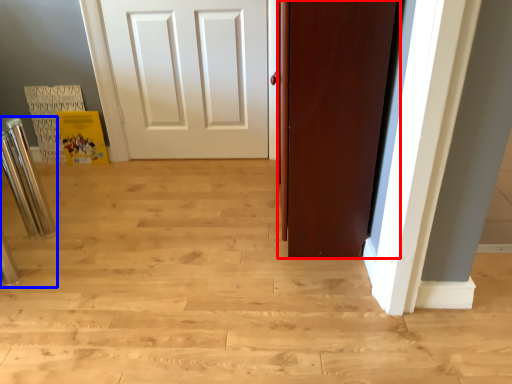
Question: Which object appears farthest to the camera in this image, door (highlighted by a red box) or bar stool (highlighted by a blue box)?

Choices:
 (A) door
 (B) bar stool

Answer: (B)